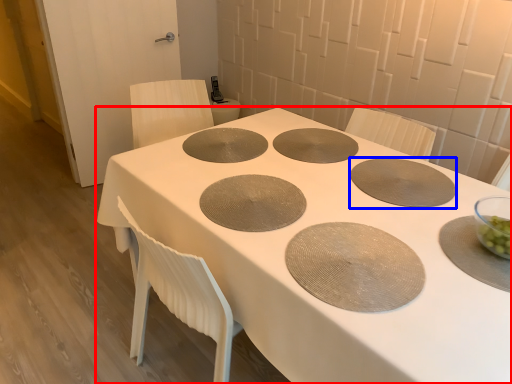
Question: Which of the following is the closest to the observer, table (highlighted by a red box) or pizza pan (highlighted by a blue box)?

Choices:
 (A) table
 (B) pizza pan

Answer: (A)